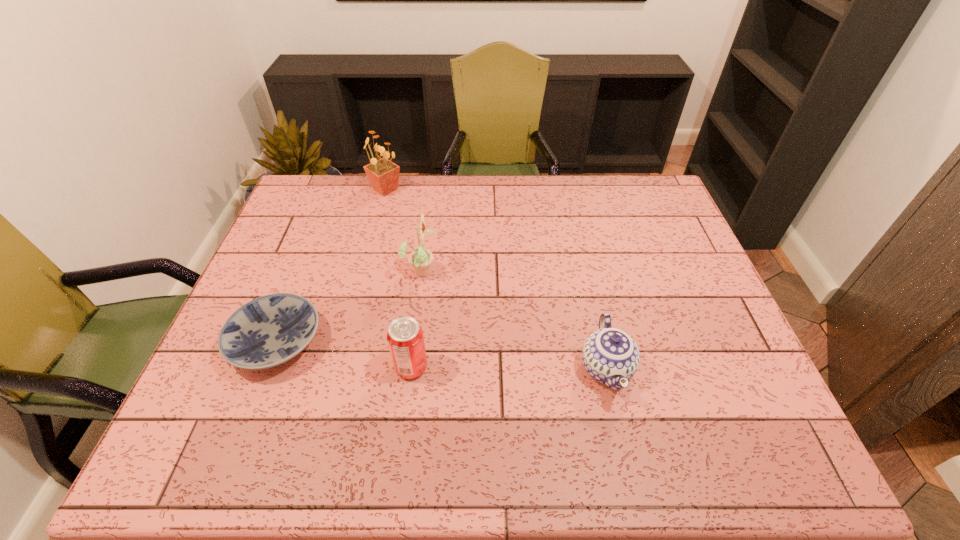
Where is `free area in between the soda and the fourth nearest object`? free area in between the soda and the fourth nearest object is located at coordinates (417, 319).

Locate an element on the screen. empty space that is in between the second farthest object and the second shortest object is located at coordinates (514, 320).

I want to click on free area in between the farthest object and the soda, so click(x=398, y=278).

Where is `blank region between the soda and the nearer sunflower`? The image size is (960, 540). blank region between the soda and the nearer sunflower is located at coordinates (417, 319).

This screenshot has width=960, height=540. In order to click on free space between the right sunflower and the fourth tallest object in this screenshot , I will do click(x=514, y=320).

In order to click on vacant area that lies between the shortest object and the soda in this screenshot , I will do (344, 355).

Locate an element on the screen. This screenshot has width=960, height=540. vacant space that's between the rightmost object and the plate is located at coordinates (442, 355).

At what (x,y) coordinates should I click in order to perform the action: click on unoccupied position between the second farthest object and the shortest object. Please return your answer as a coordinate pair (x, y). Image resolution: width=960 pixels, height=540 pixels. Looking at the image, I should click on (349, 306).

Find the location of `empty space between the chinaware and the soda`. empty space between the chinaware and the soda is located at coordinates (509, 368).

Identify which object is located as the nearest to the plate. Please provide its 2D coordinates. Your answer should be formatted as a tuple, i.e. [(x, y)], where the tuple contains the x and y coordinates of a point satisfying the conditions above.

[(405, 338)]